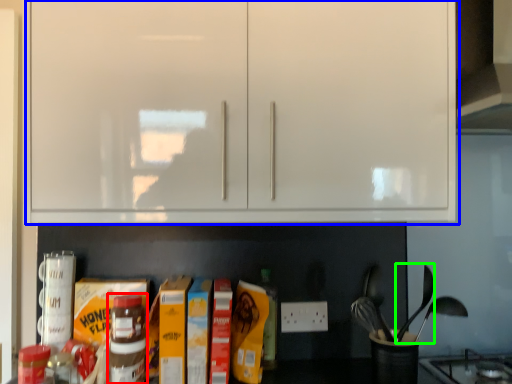
Question: Which object is positioned closest to bottle (highlighted by a red box)? Select from cabinetry (highlighted by a blue box) and silverware (highlighted by a green box).

Choices:
 (A) cabinetry
 (B) silverware

Answer: (A)